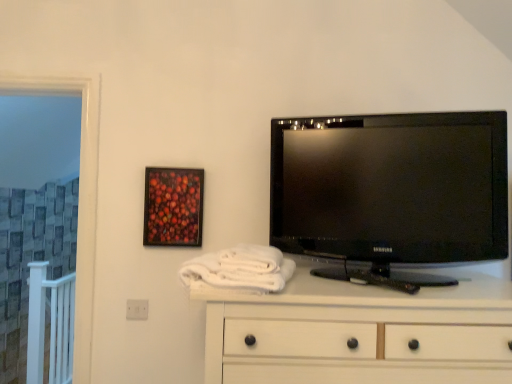
The image size is (512, 384). In order to click on white soft towel at center in this screenshot , I will do `click(240, 268)`.

You are a GUI agent. You are given a task and a screenshot of the screen. Output one action in this format:
    pyautogui.click(x=<x>, y=<y>)
    Task: Click on the wooden-framed artwork at upper left
    
    Given the screenshot: What is the action you would take?
    pyautogui.click(x=173, y=207)

Is black glossy tv at upper right at the left side of white wood chest of drawers at lower center?

In fact, black glossy tv at upper right is to the right of white wood chest of drawers at lower center.

Between black glossy tv at upper right and white wood chest of drawers at lower center, which one has larger width?

white wood chest of drawers at lower center.

Measure the distance between black glossy tv at upper right and white wood chest of drawers at lower center.

black glossy tv at upper right is 12.02 inches away from white wood chest of drawers at lower center.

From a real-world perspective, is black glossy tv at upper right on top of white wood chest of drawers at lower center?

Yes, from a real-world perspective, black glossy tv at upper right is over white wood chest of drawers at lower center

Is there a large distance between white soft towel at center and wooden-framed artwork at upper left?

No.

In the scene shown: Is white soft towel at center wider than wooden-framed artwork at upper left?

Yes, white soft towel at center is wider than wooden-framed artwork at upper left.

In the scene shown: Between white soft towel at center and wooden-framed artwork at upper left, which one has more height?

wooden-framed artwork at upper left is taller.

At what (x,y) coordinates should I click in order to perform the action: click on chest of drawers in front of the black glossy tv at upper right. Please return your answer as a coordinate pair (x, y). The width and height of the screenshot is (512, 384). Looking at the image, I should click on (359, 332).

Is white wood chest of drawers at lower center placed right next to black glossy tv at upper right?

No, white wood chest of drawers at lower center is not in contact with black glossy tv at upper right.

Which is closer to the camera, (497, 322) or (411, 250)?

Point (497, 322).

In order to click on bath towel lying on the left of black glossy tv at upper right in this screenshot , I will do `click(240, 268)`.

Does point (502, 204) come farther from viewer compared to point (242, 254)?

Yes, point (502, 204) is behind point (242, 254).

From the image's perspective, is black glossy tv at upper right above white soft towel at center?

Correct, black glossy tv at upper right appears higher than white soft towel at center in the image.

Is wooden-framed artwork at upper left facing away from black glossy tv at upper right?

wooden-framed artwork at upper left does not have its back to black glossy tv at upper right.

From the image's perspective, would you say wooden-framed artwork at upper left is positioned over black glossy tv at upper right?

No, from the image's perspective, wooden-framed artwork at upper left is not above black glossy tv at upper right.

In terms of size, does wooden-framed artwork at upper left appear bigger or smaller than black glossy tv at upper right?

Considering their sizes, wooden-framed artwork at upper left takes up less space than black glossy tv at upper right.

Considering the positions of points (469, 226) and (167, 197), is point (469, 226) closer to camera compared to point (167, 197)?

Yes, point (469, 226) is closer to viewer.

From a real-world perspective, who is located lower, black glossy tv at upper right or wooden-framed artwork at upper left?

wooden-framed artwork at upper left.

Is black glossy tv at upper right aimed at wooden-framed artwork at upper left?

No.

What's the angular difference between black glossy tv at upper right and wooden-framed artwork at upper left's facing directions?

black glossy tv at upper right and wooden-framed artwork at upper left are facing 12.7 degrees away from each other.

From the image's perspective, who appears lower, wooden-framed artwork at upper left or white soft towel at center?

white soft towel at center is shown below in the image.

Is wooden-framed artwork at upper left positioned with its back to white soft towel at center?

That's not correct — wooden-framed artwork at upper left is not looking away from white soft towel at center.

Is there a large distance between wooden-framed artwork at upper left and white soft towel at center?

They are positioned close to each other.

Looking at this image, is wooden-framed artwork at upper left to the left of white soft towel at center from the viewer's perspective?

Indeed, wooden-framed artwork at upper left is positioned on the left side of white soft towel at center.

This screenshot has width=512, height=384. In order to click on television behind the white wood chest of drawers at lower center in this screenshot , I will do `click(391, 192)`.

Identify the location of picture frame above the white soft towel at center (from a real-world perspective). (173, 207).

Estimate the real-world distances between objects in this image. Which object is closer to white wood chest of drawers at lower center, wooden-framed artwork at upper left or white soft towel at center?

white soft towel at center lies closer to white wood chest of drawers at lower center than the other object.

When comparing their distances from wooden-framed artwork at upper left, does black glossy tv at upper right or white wood chest of drawers at lower center seem closer?

black glossy tv at upper right is positioned closer to the anchor wooden-framed artwork at upper left.

Looking at the image, which one is located closer to wooden-framed artwork at upper left, white soft towel at center or white wood chest of drawers at lower center?

white soft towel at center is closer to wooden-framed artwork at upper left.

Which object lies nearer to the anchor point white soft towel at center, white wood chest of drawers at lower center or wooden-framed artwork at upper left?

Based on the image, white wood chest of drawers at lower center appears to be nearer to white soft towel at center.

Looking at this image, looking at the image, which one is located further to black glossy tv at upper right, white wood chest of drawers at lower center or white soft towel at center?

white soft towel at center lies further to black glossy tv at upper right than the other object.

Looking at the image, which one is located closer to wooden-framed artwork at upper left, white wood chest of drawers at lower center or white soft towel at center?

white soft towel at center is closer to wooden-framed artwork at upper left.

Based on the photo, when comparing their distances from white wood chest of drawers at lower center, does white soft towel at center or wooden-framed artwork at upper left seem closer?

white soft towel at center lies closer to white wood chest of drawers at lower center than the other object.

Estimate the real-world distances between objects in this image. Which object is further from wooden-framed artwork at upper left, white wood chest of drawers at lower center or black glossy tv at upper right?

white wood chest of drawers at lower center.

In order to click on bath towel between wooden-framed artwork at upper left and black glossy tv at upper right in the horizontal direction in this screenshot , I will do `click(240, 268)`.

You are a GUI agent. You are given a task and a screenshot of the screen. Output one action in this format:
    pyautogui.click(x=<x>, y=<y>)
    Task: Click on the chest of drawers between white soft towel at center and black glossy tv at upper right from left to right
    The image size is (512, 384).
    Given the screenshot: What is the action you would take?
    pyautogui.click(x=359, y=332)

Find the location of a particular element. This screenshot has height=384, width=512. bath towel located between wooden-framed artwork at upper left and white wood chest of drawers at lower center in the left-right direction is located at coordinates (240, 268).

Identify the location of the chest of drawers situated between wooden-framed artwork at upper left and black glossy tv at upper right from left to right. The height and width of the screenshot is (384, 512). (359, 332).